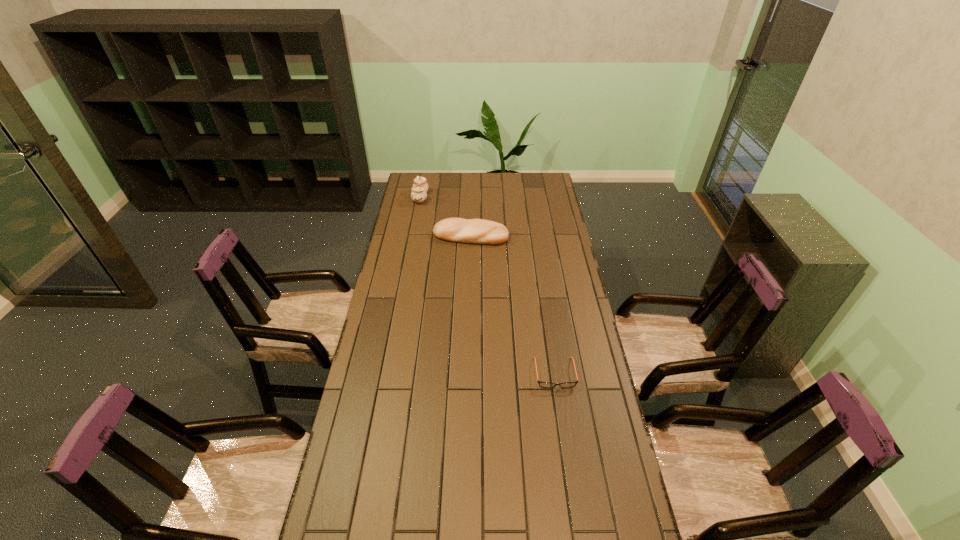
This screenshot has width=960, height=540. Find the location of `object that is at the left edge`. object that is at the left edge is located at coordinates (420, 186).

Locate an element on the screen. object situated at the right edge is located at coordinates (542, 384).

The width and height of the screenshot is (960, 540). I want to click on object that is at the far left corner, so click(x=420, y=186).

The height and width of the screenshot is (540, 960). Identify the location of free space at the far edge of the desktop. (463, 189).

At what (x,y) coordinates should I click in order to perform the action: click on vacant point at the left edge. Please return your answer as a coordinate pair (x, y). Image resolution: width=960 pixels, height=540 pixels. Looking at the image, I should click on (383, 338).

What are the coordinates of `vacant space at the right edge` in the screenshot? It's located at (569, 333).

This screenshot has width=960, height=540. I want to click on vacant space at the far left corner of the desktop, so click(x=429, y=184).

In the image, there is a desktop. Where is `vacant space at the far right corner`? vacant space at the far right corner is located at coordinates (533, 190).

The width and height of the screenshot is (960, 540). In order to click on vacant area between the leftmost object and the nearest object in this screenshot , I will do 488,285.

The height and width of the screenshot is (540, 960). I want to click on unoccupied position between the tallest object and the rightmost object, so click(488, 285).